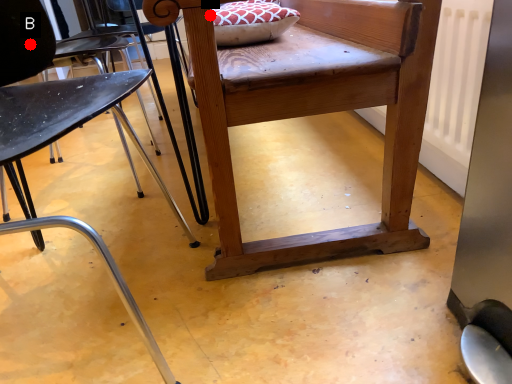
Question: Two points are circled on the image, labeled by A and B beside each circle. Among these points, which one is farthest from the camera?

Choices:
 (A) A is further
 (B) B is further

Answer: (A)